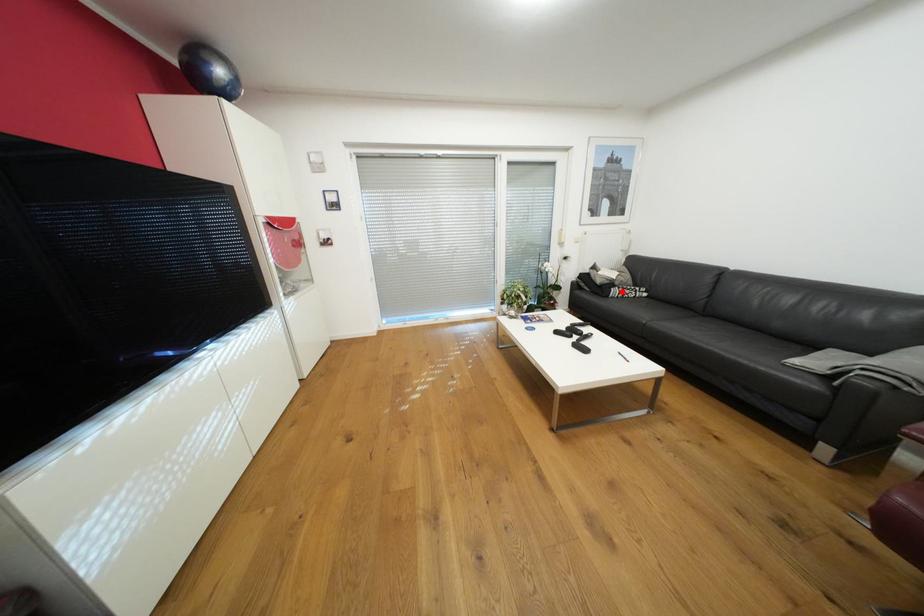
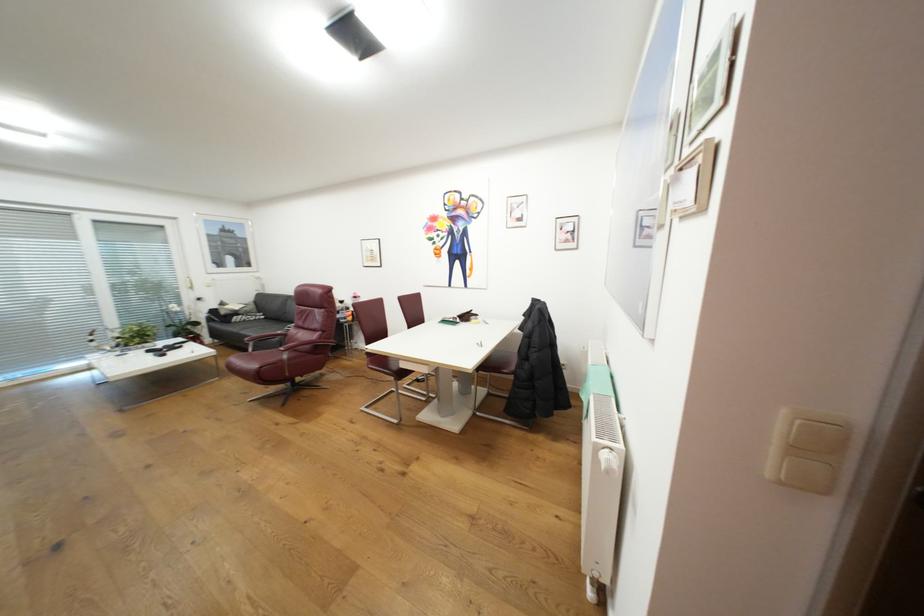
Where in the second image is the point corresponding to the highlighted location from the first image?

(244, 318)